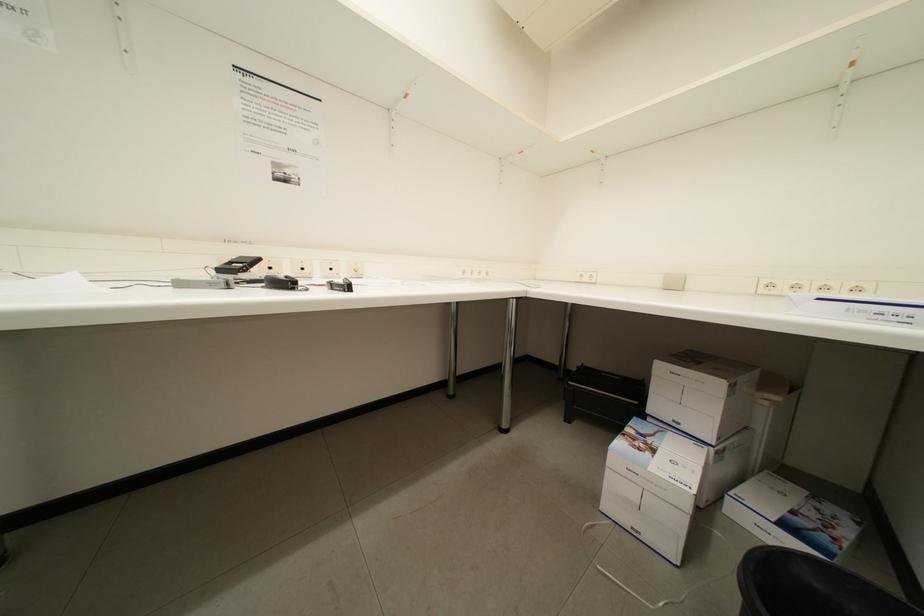
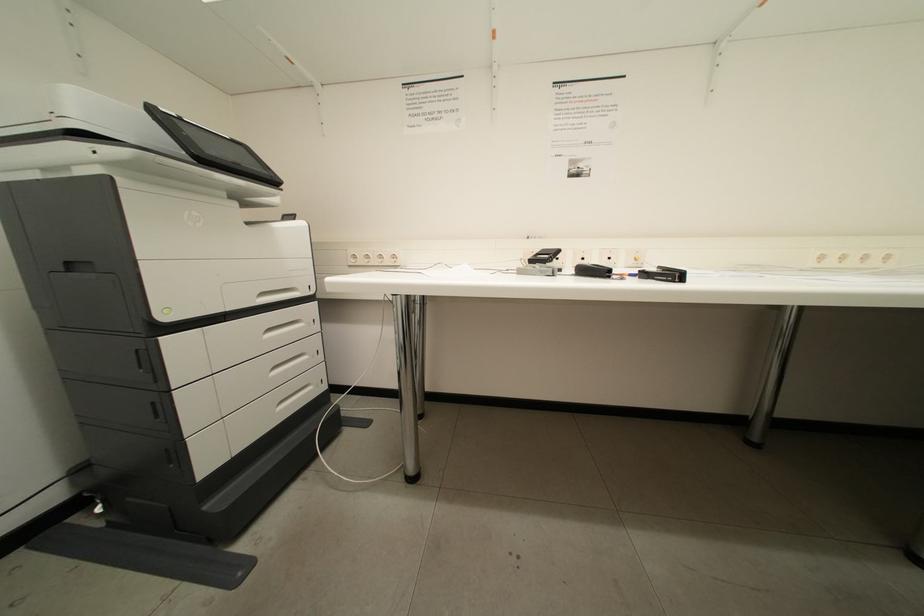
Question: The first image is from the beginning of the video and the second image is from the end. How did the camera likely rotate when shooting the video?

Choices:
 (A) Left
 (B) Right
 (C) Up
 (D) Down

Answer: (A)